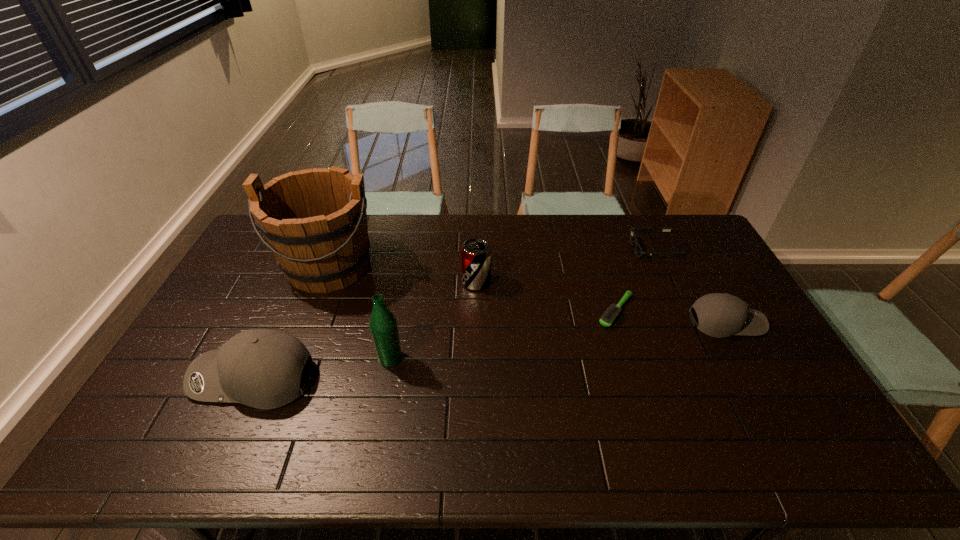
This screenshot has height=540, width=960. What are the coordinates of `the left baseball cap` in the screenshot? It's located at (262, 368).

At what (x,y) coordinates should I click in order to perform the action: click on the taller baseball cap. Please return your answer as a coordinate pair (x, y). This screenshot has height=540, width=960. Looking at the image, I should click on click(262, 368).

The height and width of the screenshot is (540, 960). What are the coordinates of `the farther baseball cap` in the screenshot? It's located at (720, 315).

Image resolution: width=960 pixels, height=540 pixels. Find the location of `the right baseball cap`. the right baseball cap is located at coordinates (720, 315).

The height and width of the screenshot is (540, 960). Find the location of `the second shortest object`. the second shortest object is located at coordinates (638, 250).

Identify the location of the tallest object. (314, 221).

Locate an element on the screen. the third object from right to left is located at coordinates (608, 317).

I want to click on hairbrush, so click(x=608, y=317).

Where is `the fourth object from right to left`? the fourth object from right to left is located at coordinates (476, 254).

Where is `the fifth object from right to left`? The width and height of the screenshot is (960, 540). the fifth object from right to left is located at coordinates pos(383,326).